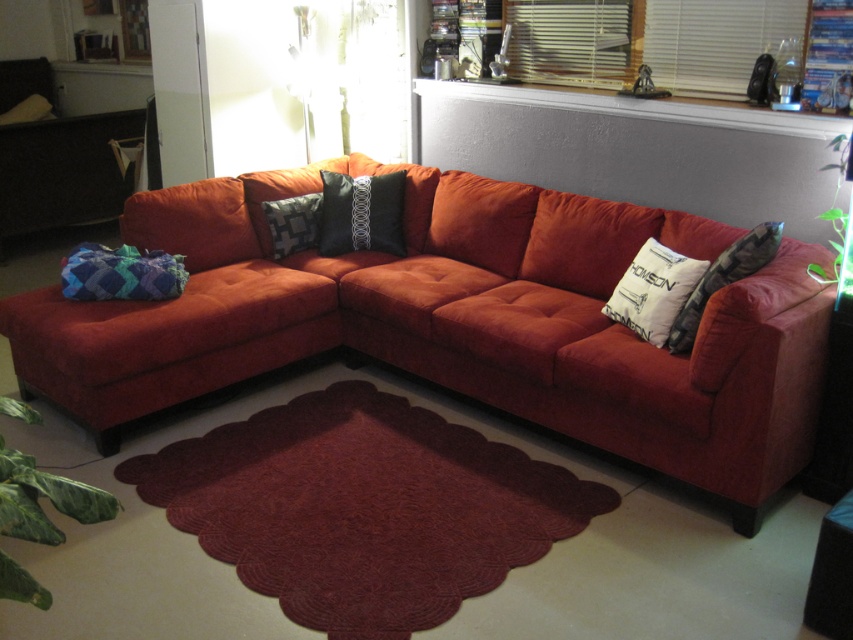
You are arranging a photo shoot in the living room and need to position a small lamp between the knitted wool pillow at left and the white printed pillow at right. Based on their positions, where should the lamp be placed relative to the pillows?

The knitted wool pillow at left is located above the white printed pillow at right. Therefore, the lamp should be placed below the knitted wool pillow at left and above the white printed pillow at right to position it between them.